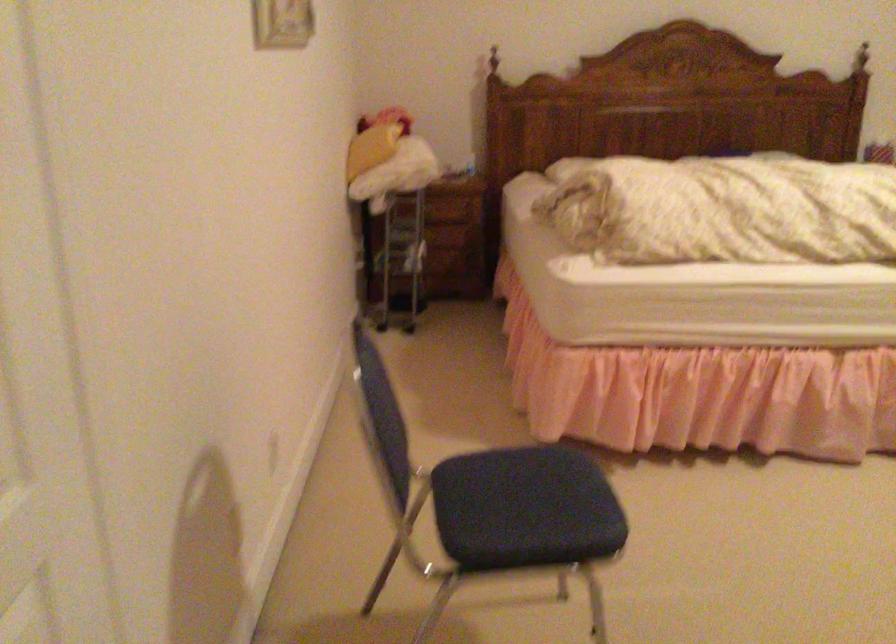
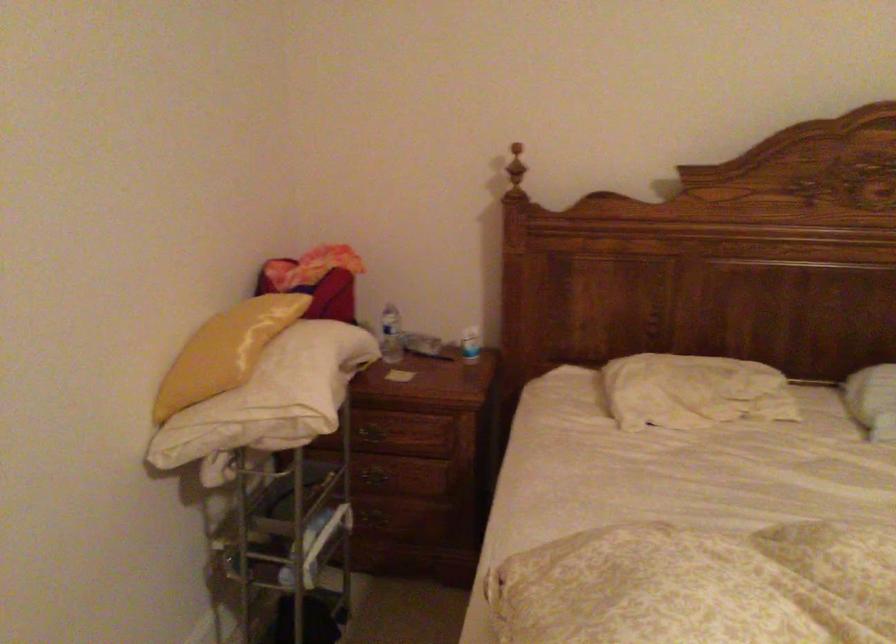
Where in the second image is the point corresponding to point (375, 134) from the first image?

(225, 351)